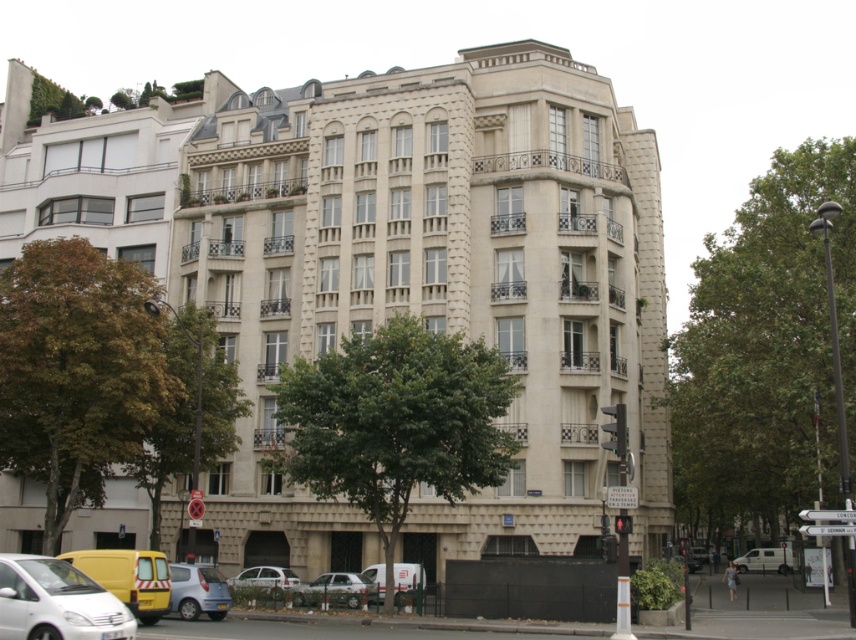
Which is behind, point (146, 612) or point (262, 579)?

The point (262, 579) is behind.

Can you confirm if yellow matte van at lower left is thinner than white matte car at lower center?

No.

Between point (100, 554) and point (238, 577), which one is positioned behind?

The point (238, 577) is behind.

Locate an element on the screen. The image size is (856, 640). yellow matte van at lower left is located at coordinates (129, 577).

Is point (164, 189) farther from camera compared to point (270, 586)?

That is True.

Between beige stone building at center and white matte car at lower center, which one is positioned higher?

beige stone building at center is above.

Is point (330, 147) closer to viewer compared to point (288, 582)?

No.

The image size is (856, 640). Find the location of `beige stone building at center`. beige stone building at center is located at coordinates (390, 272).

Is white matte van at lower left smaller than metallic silver car at lower center?

Actually, white matte van at lower left might be larger than metallic silver car at lower center.

Who is more forward, (43,563) or (224,596)?

Positioned in front is point (43,563).

Where is `white matte van at lower left`? The width and height of the screenshot is (856, 640). white matte van at lower left is located at coordinates (56, 602).